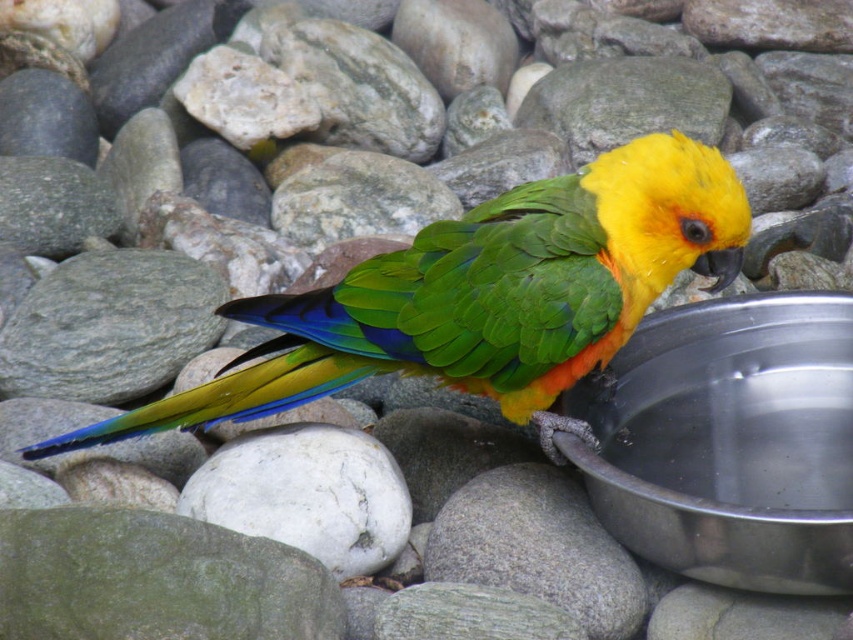
Is shiny green parrot at center to the left of metallic silver basin at lower right from the viewer's perspective?

Yes, shiny green parrot at center is to the left of metallic silver basin at lower right.

Is shiny green parrot at center above metallic silver basin at lower right?

Indeed, shiny green parrot at center is positioned over metallic silver basin at lower right.

The height and width of the screenshot is (640, 853). What do you see at coordinates (485, 296) in the screenshot?
I see `shiny green parrot at center` at bounding box center [485, 296].

Locate an element on the screen. Image resolution: width=853 pixels, height=640 pixels. shiny green parrot at center is located at coordinates (485, 296).